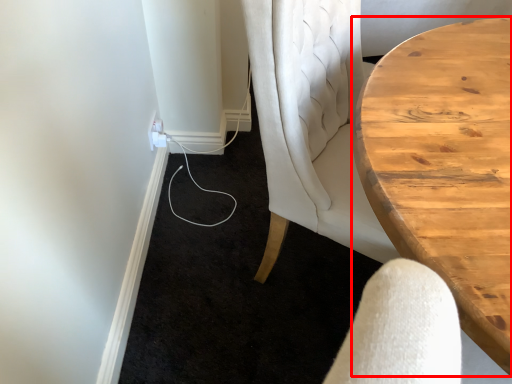
Question: From the image's perspective, where is table (annotated by the red box) located in relation to electric outlet in the image?

Choices:
 (A) below
 (B) above

Answer: (A)